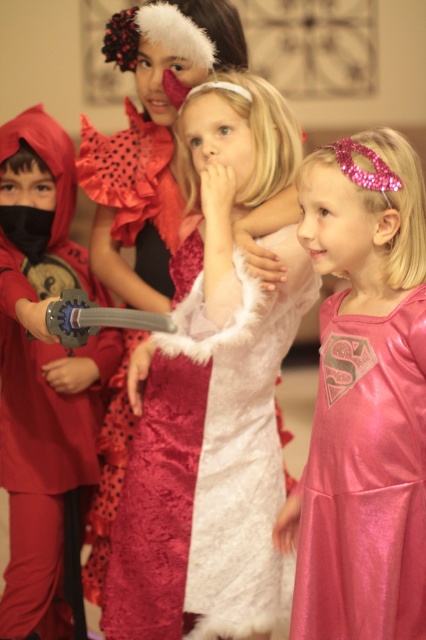
Is point (36, 515) closer to camera compared to point (157, 129)?

Yes.

Between point (37, 381) and point (137, 36), which one is positioned behind?

The point (37, 381) is behind.

Which is in front, point (5, 282) or point (117, 148)?

Point (5, 282)

Find the location of a particular element. matte red ninja suit at left is located at coordinates (45, 381).

Who is taller, pink shiny dress at right or velvet dress at center?

velvet dress at center

Who is more distant from viewer, (412, 612) or (126, 52)?

Point (126, 52)

Describe the element at coordinates (365, 480) in the screenshot. I see `pink shiny dress at right` at that location.

Identify the location of pink shiny dress at right. (365, 480).

Is point (37, 257) positioned behind point (377, 378)?

Yes.

Which of these two, matte red ninja suit at left or pink shiny dress at right, stands shorter?

Standing shorter between the two is pink shiny dress at right.

Image resolution: width=426 pixels, height=640 pixels. Identify the location of matte red ninja suit at left. (45, 381).